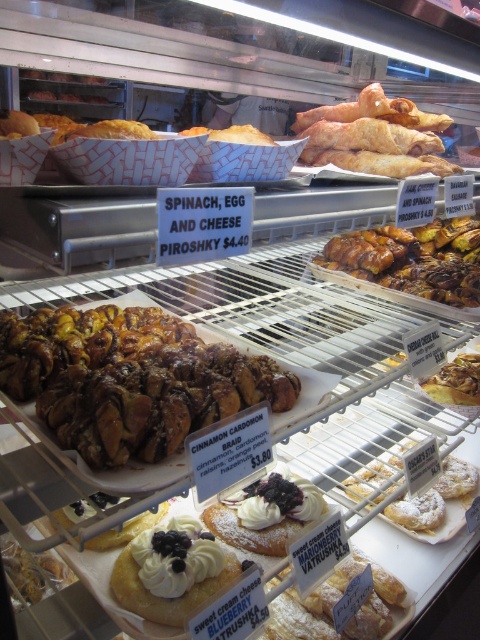
Question: Which object is farther from the camera taking this photo?

Choices:
 (A) powdered sugar pastry at center
 (B) white powdered sugar blueberry-filled pastry at center
 (C) cinnamon-sugar pastry at center

Answer: (A)

Question: Which point appears farthest from the camera in this image?

Choices:
 (A) (360, 612)
 (B) (429, 227)

Answer: (B)

Question: Can you confirm if cinnamon-sugar pastry at center is thinner than golden brown flaky croissant at upper right?

Choices:
 (A) no
 (B) yes

Answer: (A)

Question: Where is white cream-filled donut at center located in relation to white powdered sugar blueberry-filled pastry at center in the image?

Choices:
 (A) right
 (B) left

Answer: (B)

Question: Which point is farther to the camera?

Choices:
 (A) white powdered sugar blueberry-filled pastry at center
 (B) white cream-filled donut at center
 (C) powdered sugar pastry at center

Answer: (C)

Question: Where is white cream-filled donut at center located in relation to white powdered sugar blueberry-filled pastry at center in the image?

Choices:
 (A) below
 (B) above

Answer: (A)